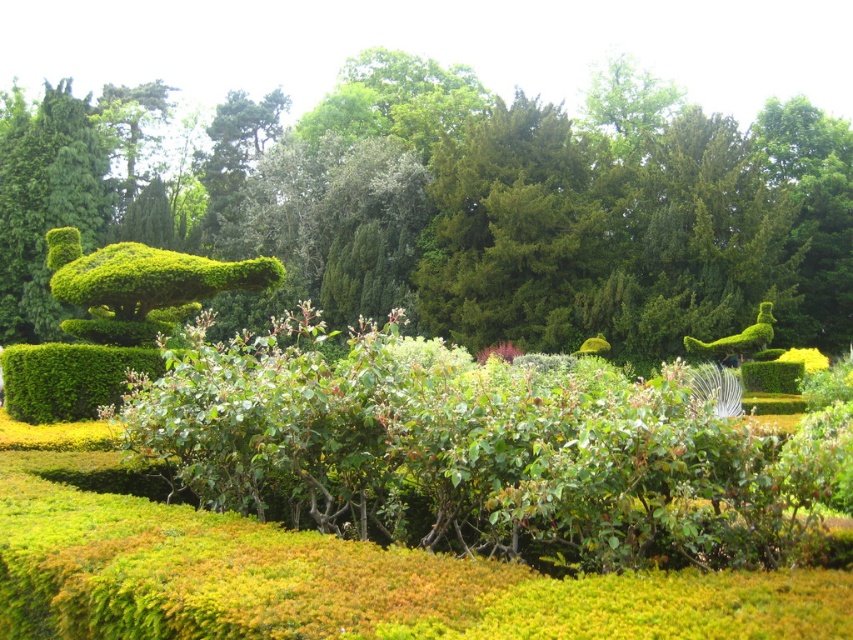
Question: In this image, where is green bushy hedge at center located relative to yellow matte flower at center-right?

Choices:
 (A) above
 (B) below

Answer: (A)

Question: Can you confirm if green bushy hedge at center is positioned below yellow matte flower at center-right?

Choices:
 (A) no
 (B) yes

Answer: (A)

Question: Which of the following is the farthest from the observer?

Choices:
 (A) green bushy hedge at center
 (B) yellow matte flower at center-right

Answer: (A)

Question: Which point appears closest to the camera in this image?

Choices:
 (A) (802, 355)
 (B) (666, 282)

Answer: (A)

Question: Among these objects, which one is farthest from the camera?

Choices:
 (A) yellow matte flower at center-right
 (B) green bushy hedge at center

Answer: (B)

Question: Does green bushy hedge at center have a lesser width compared to yellow matte flower at center-right?

Choices:
 (A) no
 (B) yes

Answer: (A)